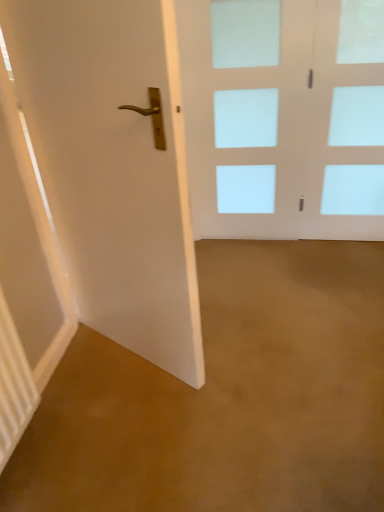
Question: Should I look upward or downward to see white glossy door at left, positioned as the 1th door in left-to-right order?

Choices:
 (A) down
 (B) up

Answer: (B)

Question: Is white glass door at center, the 1th door positioned from the back, far away from white glossy door at left, which is the first door from front to back?

Choices:
 (A) no
 (B) yes

Answer: (B)

Question: Could you tell me if white glass door at center, marked as the second door in a front-to-back arrangement, is facing white glossy door at left, positioned as the 1th door in left-to-right order?

Choices:
 (A) yes
 (B) no

Answer: (A)

Question: From a real-world perspective, is white glass door at center, which is the 1th door in right-to-left order, below white glossy door at left, which is the 2th door from right to left?

Choices:
 (A) no
 (B) yes

Answer: (B)

Question: Is white glass door at center, which is the 1th door in right-to-left order, completely or partially outside of white glossy door at left, which is the second door from back to front?

Choices:
 (A) no
 (B) yes

Answer: (B)

Question: Is white glass door at center, marked as the second door in a front-to-back arrangement, shorter than white glossy door at left, positioned as the 1th door in left-to-right order?

Choices:
 (A) yes
 (B) no

Answer: (A)

Question: Considering the relative sizes of white glass door at center, marked as the second door in a front-to-back arrangement, and white glossy door at left, positioned as the 1th door in left-to-right order, in the image provided, is white glass door at center, marked as the second door in a front-to-back arrangement, bigger than white glossy door at left, positioned as the 1th door in left-to-right order,?

Choices:
 (A) no
 (B) yes

Answer: (A)

Question: Does white glass door at center, which is the 1th door in right-to-left order, have a greater width compared to clear glass door at upper right?

Choices:
 (A) yes
 (B) no

Answer: (B)

Question: Would you say white glass door at center, which is the 1th door in right-to-left order, is outside clear glass door at upper right?

Choices:
 (A) no
 (B) yes

Answer: (B)

Question: Is white glass door at center, marked as the second door in a front-to-back arrangement, oriented away from clear glass door at upper right?

Choices:
 (A) yes
 (B) no

Answer: (B)

Question: From a real-world perspective, does white glass door at center, which is the 1th door in right-to-left order, sit lower than clear glass door at upper right?

Choices:
 (A) yes
 (B) no

Answer: (B)

Question: Considering the relative positions of white glass door at center, marked as the second door in a front-to-back arrangement, and clear glass door at upper right in the image provided, is white glass door at center, marked as the second door in a front-to-back arrangement, to the left of clear glass door at upper right from the viewer's perspective?

Choices:
 (A) yes
 (B) no

Answer: (A)

Question: Considering the relative sizes of white glass door at center, which is the 1th door in right-to-left order, and clear glass door at upper right in the image provided, is white glass door at center, which is the 1th door in right-to-left order, thinner than clear glass door at upper right?

Choices:
 (A) no
 (B) yes

Answer: (B)

Question: Is clear glass door at upper right turned away from white glossy door at left, which is the 2th door from right to left?

Choices:
 (A) no
 (B) yes

Answer: (A)